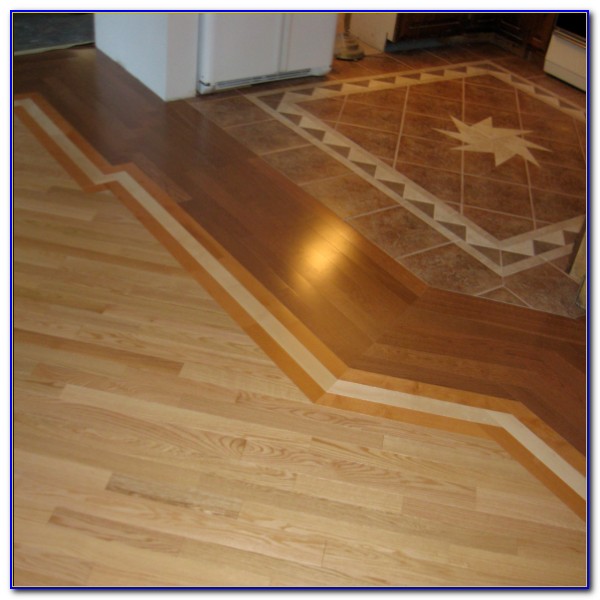
What are the coordinates of `carpeting` in the screenshot? It's located at (47, 28).